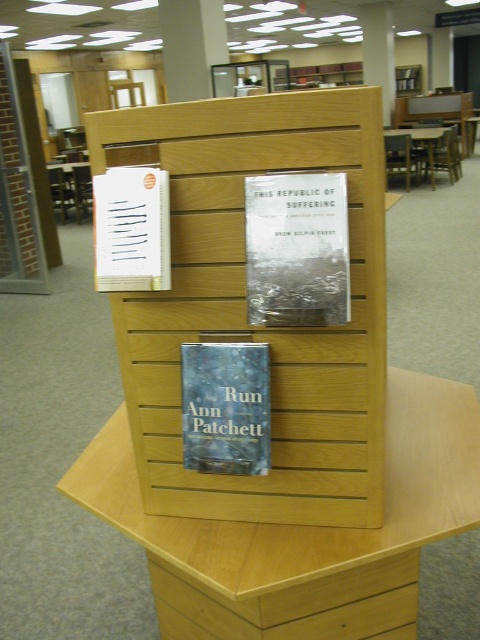
Question: Which of these objects is positioned farthest from the wooden at center?

Choices:
 (A) wooden slat display at center
 (B) blue paper at center

Answer: (B)

Question: Does wooden slat display at center have a lesser width compared to wooden table at center?

Choices:
 (A) yes
 (B) no

Answer: (A)

Question: Estimate the real-world distances between objects in this image. Which object is closer to the wooden table at center?

Choices:
 (A) brown wooden table at center
 (B) white paper at upper left
 (C) wooden at center
 (D) hardcover book at center

Answer: (A)

Question: From the image, what is the correct spatial relationship of blue paper at center in relation to white paper at upper left?

Choices:
 (A) above
 (B) below

Answer: (B)

Question: Considering the real-world distances, which object is farthest from the blue paper at center?

Choices:
 (A) white paper at upper left
 (B) brown wooden table at center
 (C) wooden slat display at center
 (D) wooden at center

Answer: (B)

Question: From the image, what is the correct spatial relationship of blue paper at center in relation to wooden table at center?

Choices:
 (A) left
 (B) right

Answer: (B)